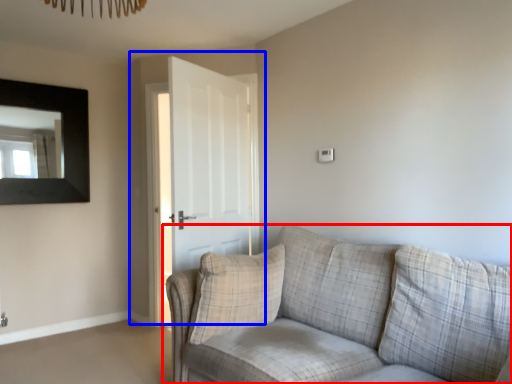
Question: Which object is closer to the camera taking this photo, studio couch (highlighted by a red box) or door (highlighted by a blue box)?

Choices:
 (A) studio couch
 (B) door

Answer: (A)